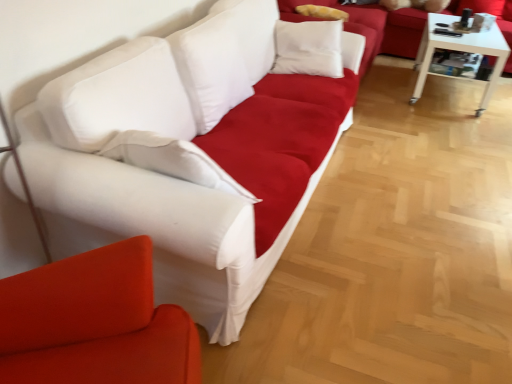
Question: Is matte white couch at upper center bigger than white glossy table at right?

Choices:
 (A) yes
 (B) no

Answer: (A)

Question: Does matte white couch at upper center have a lesser width compared to white glossy table at right?

Choices:
 (A) no
 (B) yes

Answer: (B)

Question: From the image's perspective, does matte white couch at upper center appear lower than white glossy table at right?

Choices:
 (A) no
 (B) yes

Answer: (A)

Question: Does matte white couch at upper center have a greater height compared to white glossy table at right?

Choices:
 (A) no
 (B) yes

Answer: (B)

Question: Is matte white couch at upper center to the right of white glossy table at right from the viewer's perspective?

Choices:
 (A) yes
 (B) no

Answer: (B)

Question: From a real-world perspective, is white fabric couch at left, the 1th studio couch positioned from the front, positioned above or below white fabric studio couch at upper center, which appears as the 3th studio couch when viewed from the front?

Choices:
 (A) above
 (B) below

Answer: (A)

Question: Considering the positions of white fabric couch at left, which is the third studio couch from back to front, and white fabric studio couch at upper center, the first studio couch viewed from the back, in the image, is white fabric couch at left, which is the third studio couch from back to front, bigger or smaller than white fabric studio couch at upper center, the first studio couch viewed from the back,?

Choices:
 (A) big
 (B) small

Answer: (B)

Question: In the image, is white fabric couch at left, which is the third studio couch from back to front, on the left side or the right side of white fabric studio couch at upper center, which appears as the 3th studio couch when viewed from the front?

Choices:
 (A) right
 (B) left

Answer: (B)

Question: Is white fabric couch at left, the 1th studio couch positioned from the front, in front of or behind white fabric studio couch at upper center, the first studio couch viewed from the back, in the image?

Choices:
 (A) front
 (B) behind

Answer: (A)

Question: Based on their sizes in the image, would you say white fabric couch at left, the 1th studio couch positioned from the front, is bigger or smaller than white glossy table at right?

Choices:
 (A) big
 (B) small

Answer: (A)

Question: Is white fabric couch at left, which is the third studio couch from back to front, wider or thinner than white glossy table at right?

Choices:
 (A) thin
 (B) wide

Answer: (A)

Question: From the image's perspective, is white fabric couch at left, which is the third studio couch from back to front, positioned above or below white glossy table at right?

Choices:
 (A) below
 (B) above

Answer: (A)

Question: Is white fabric couch at left, the 1th studio couch positioned from the front, inside or outside of white glossy table at right?

Choices:
 (A) outside
 (B) inside

Answer: (A)

Question: In the image, is white fabric studio couch at upper center, which appears as the 3th studio couch when viewed from the front, on the left side or the right side of white fabric couch at left, the 1th studio couch positioned from the front?

Choices:
 (A) left
 (B) right

Answer: (B)

Question: Relative to white fabric couch at left, which is the third studio couch from back to front, is white fabric studio couch at upper center, the first studio couch viewed from the back, in front or behind?

Choices:
 (A) behind
 (B) front

Answer: (A)